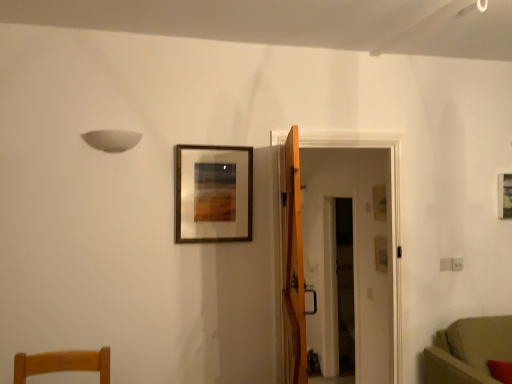
Question: Does transparent glass door at center have a larger size compared to wooden door at center?

Choices:
 (A) no
 (B) yes

Answer: (B)

Question: Is transparent glass door at center further to the viewer compared to wooden door at center?

Choices:
 (A) yes
 (B) no

Answer: (A)

Question: Can you confirm if transparent glass door at center is smaller than wooden door at center?

Choices:
 (A) yes
 (B) no

Answer: (B)

Question: From the image's perspective, is transparent glass door at center over wooden door at center?

Choices:
 (A) no
 (B) yes

Answer: (A)

Question: From a real-world perspective, is transparent glass door at center physically below wooden door at center?

Choices:
 (A) yes
 (B) no

Answer: (A)

Question: Does transparent glass door at center turn towards wooden door at center?

Choices:
 (A) no
 (B) yes

Answer: (A)

Question: From a real-world perspective, is matte gold picture frame at upper right, which is counted as the first picture frame, starting from the back, located higher than suede-like beige sofa at lower right?

Choices:
 (A) no
 (B) yes

Answer: (B)

Question: Considering the relative sizes of matte gold picture frame at upper right, which is counted as the first picture frame, starting from the back, and suede-like beige sofa at lower right in the image provided, is matte gold picture frame at upper right, which is counted as the first picture frame, starting from the back, thinner than suede-like beige sofa at lower right?

Choices:
 (A) yes
 (B) no

Answer: (A)

Question: Can you confirm if matte gold picture frame at upper right, placed as the third picture frame when sorted from front to back, is taller than suede-like beige sofa at lower right?

Choices:
 (A) yes
 (B) no

Answer: (B)

Question: From the image's perspective, is matte gold picture frame at upper right, the second picture frame positioned from the left, under suede-like beige sofa at lower right?

Choices:
 (A) no
 (B) yes

Answer: (A)

Question: Is matte gold picture frame at upper right, the second picture frame viewed from the right, facing away from suede-like beige sofa at lower right?

Choices:
 (A) no
 (B) yes

Answer: (A)

Question: Can you confirm if matte gold picture frame at upper right, which is counted as the first picture frame, starting from the back, is bigger than suede-like beige sofa at lower right?

Choices:
 (A) yes
 (B) no

Answer: (B)

Question: Could you tell me if transparent glass door at center is facing matte gold picture frame at upper right, the second picture frame viewed from the right?

Choices:
 (A) yes
 (B) no

Answer: (B)